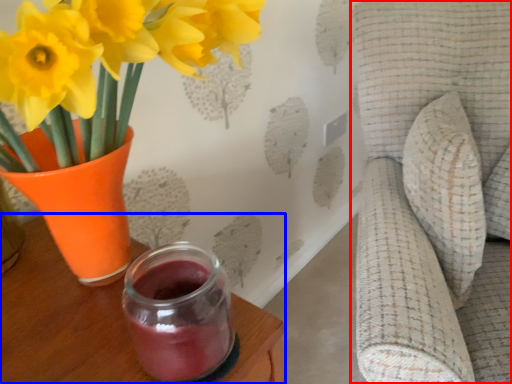
Question: Among these objects, which one is farthest to the camera, swivel chair (highlighted by a red box) or table (highlighted by a blue box)?

Choices:
 (A) swivel chair
 (B) table

Answer: (B)